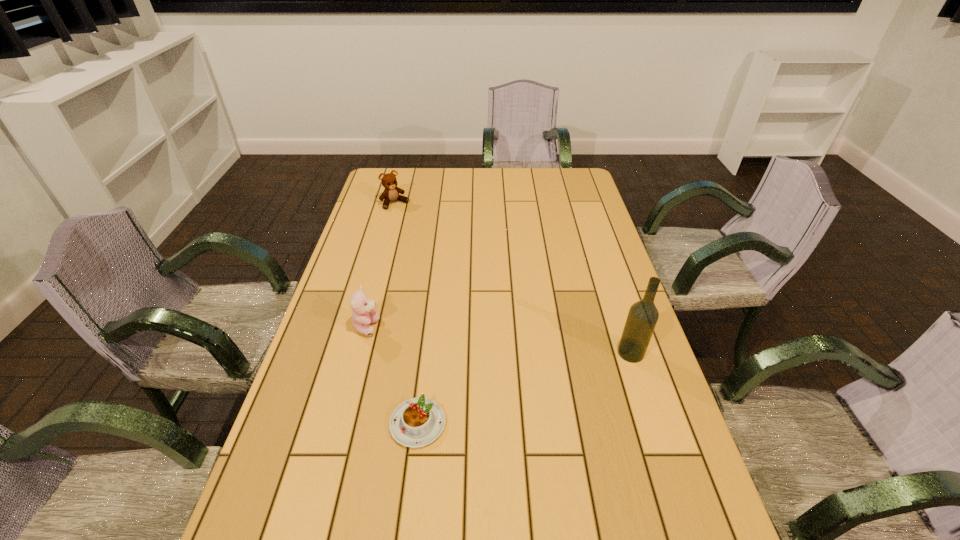
Image resolution: width=960 pixels, height=540 pixels. What are the coordinates of `free space located 0.210m on the front-facing side of the farthest object` in the screenshot? It's located at (426, 237).

Where is `vacant space located at the face of the third nearest object`? The width and height of the screenshot is (960, 540). vacant space located at the face of the third nearest object is located at coordinates (402, 343).

This screenshot has width=960, height=540. I want to click on vacant area situated at the face of the third nearest object, so click(x=394, y=339).

Find the location of a particular element. vacant region located 0.120m at the face of the third nearest object is located at coordinates (415, 348).

The height and width of the screenshot is (540, 960). In order to click on object that is positioned at the right edge in this screenshot , I will do `click(643, 315)`.

You are a GUI agent. You are given a task and a screenshot of the screen. Output one action in this format:
    pyautogui.click(x=<x>, y=<y>)
    Task: Click on the vacant space at the far edge of the desktop
    The width and height of the screenshot is (960, 540).
    Given the screenshot: What is the action you would take?
    pyautogui.click(x=444, y=193)

You are a GUI agent. You are given a task and a screenshot of the screen. Output one action in this format:
    pyautogui.click(x=<x>, y=<y>)
    Task: Click on the vacant area at the near edge of the desktop
    This screenshot has width=960, height=540.
    Given the screenshot: What is the action you would take?
    point(603,495)

Locate an element on the screen. The width and height of the screenshot is (960, 540). vacant space at the left edge of the desktop is located at coordinates (357, 266).

This screenshot has height=540, width=960. What are the coordinates of `vacant region at the right edge` in the screenshot? It's located at (561, 217).

Find the location of a particular element. free location at the far right corner is located at coordinates (555, 180).